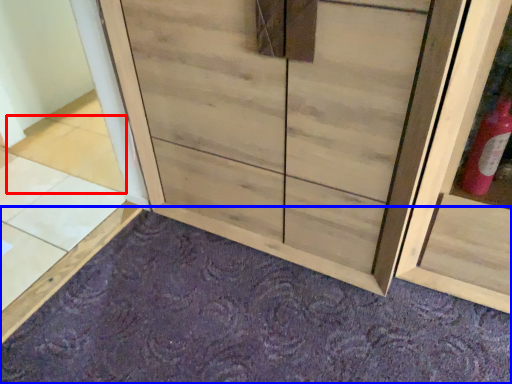
Question: Among these objects, which one is nearest to the camera, tile (highlighted by a red box) or plain (highlighted by a blue box)?

Choices:
 (A) tile
 (B) plain

Answer: (B)